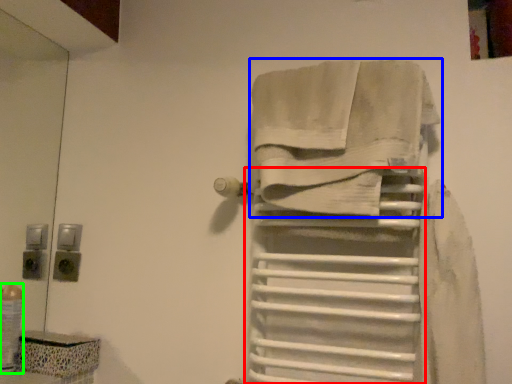
Question: Based on their relative distances, which object is farther from shelf (highlighted by a red box)? Choose from towel (highlighted by a blue box) and toiletry (highlighted by a green box).

Choices:
 (A) towel
 (B) toiletry

Answer: (B)